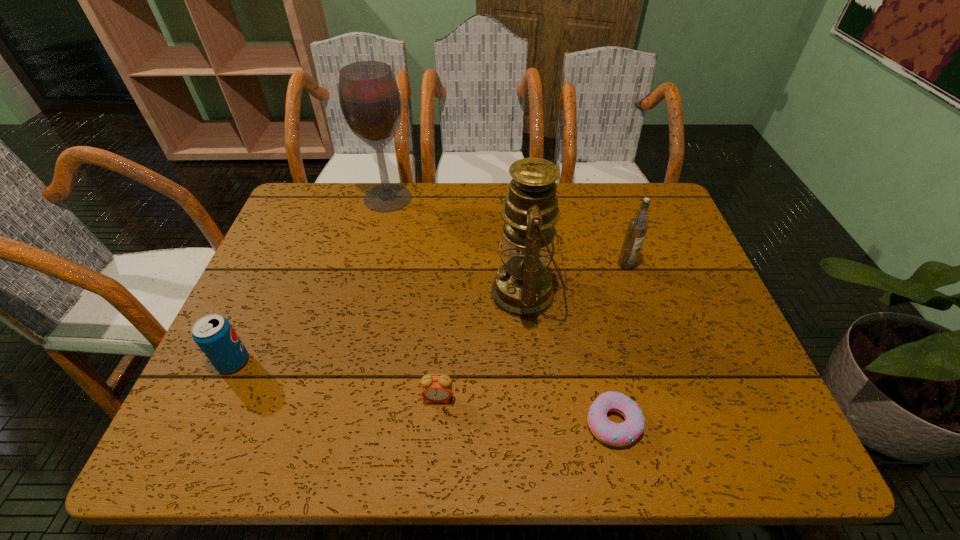
The image size is (960, 540). Identify the location of vacant region between the shortest object and the second shortest object. (526, 410).

I want to click on vacant area that lies between the oil lamp and the third object from left to right, so click(x=482, y=346).

Locate an element on the screen. This screenshot has width=960, height=540. vacant space in between the rightmost object and the soda can is located at coordinates (429, 313).

Locate an element on the screen. Image resolution: width=960 pixels, height=540 pixels. free space between the doughnut and the alarm clock is located at coordinates (526, 410).

Identify the location of free space between the oil lamp and the second object from left to right. This screenshot has height=540, width=960. (457, 246).

At what (x,y) coordinates should I click in order to perform the action: click on empty space that is in between the fifth object from right to left and the alarm clock. Please return your answer as a coordinate pair (x, y). This screenshot has height=540, width=960. Looking at the image, I should click on (413, 298).

You are a GUI agent. You are given a task and a screenshot of the screen. Output one action in this format:
    pyautogui.click(x=<x>, y=<y>)
    Task: Click on the third closest object to the oil lamp
    Image resolution: width=960 pixels, height=540 pixels.
    Given the screenshot: What is the action you would take?
    pyautogui.click(x=437, y=389)

At what (x,y) coordinates should I click in order to perform the action: click on object that is the closest to the oil lamp. Please return your answer as a coordinate pair (x, y). The image size is (960, 540). Looking at the image, I should click on (637, 228).

This screenshot has height=540, width=960. I want to click on vacant space that satisfies the following two spatial constraints: 1. on the face of the doughnut; 2. on the right side of the alarm clock, so click(437, 422).